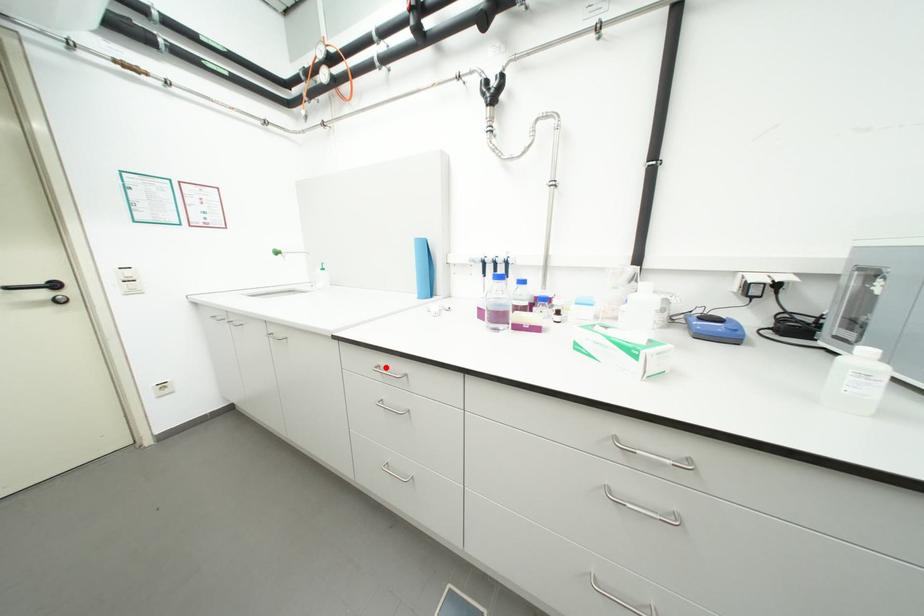
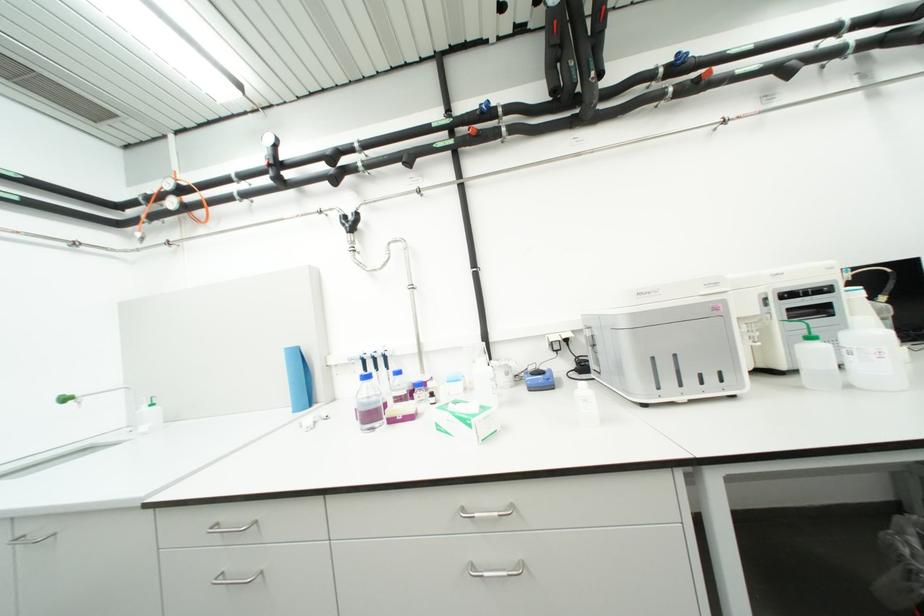
In the second image, find the point that corresponds to the highlighted location in the first image.

(224, 525)